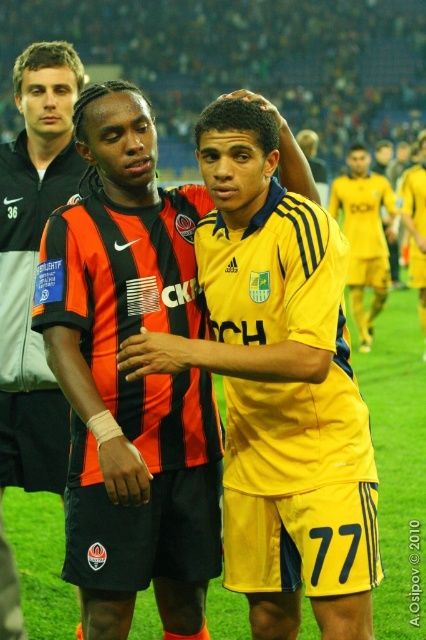
Is orange and black jersey at left wider than yellow jersey at center?

No, orange and black jersey at left is not wider than yellow jersey at center.

This screenshot has width=426, height=640. What do you see at coordinates (34, 262) in the screenshot?
I see `orange and black jersey at left` at bounding box center [34, 262].

Which is in front, point (48, 396) or point (357, 260)?

Positioned in front is point (48, 396).

Identify the location of orange and black jersey at left. (34, 262).